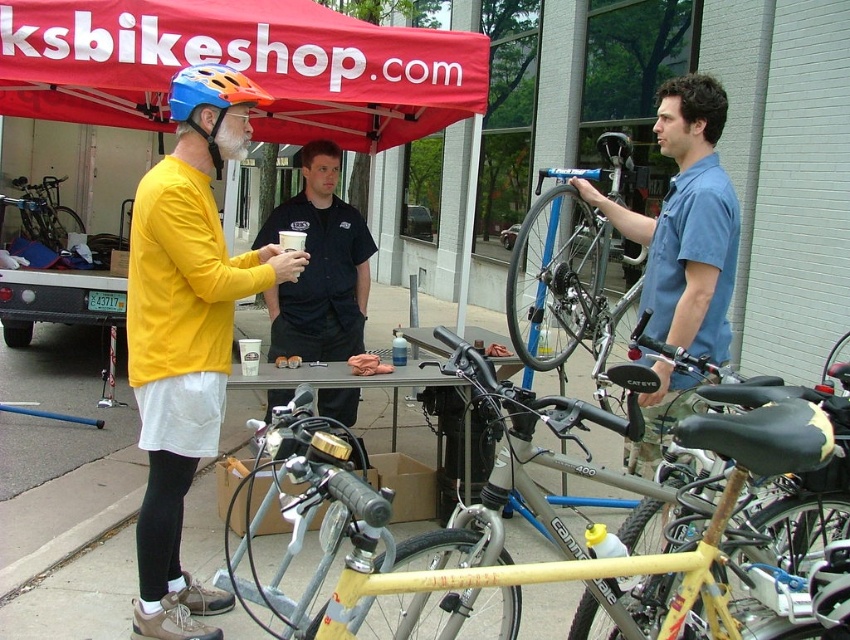
Question: Is blue metallic frame at center below black smooth shirt at center?

Choices:
 (A) no
 (B) yes

Answer: (A)

Question: Can you confirm if red fabric canopy at upper center is thinner than matte blue bicycle helmet at upper left?

Choices:
 (A) yes
 (B) no

Answer: (B)

Question: Which point appears farthest from the camera in this image?

Choices:
 (A) (23, 188)
 (B) (187, 67)
 (C) (552, 538)

Answer: (A)

Question: Does matte black bike at center have a lesser width compared to red fabric canopy at upper center?

Choices:
 (A) yes
 (B) no

Answer: (A)

Question: Which object is closer to the camera taking this photo?

Choices:
 (A) red fabric canopy at upper center
 (B) yellow long-sleeve shirt at center
 (C) blue metallic frame at center

Answer: (B)

Question: Which of the following is the farthest from the observer?

Choices:
 (A) yellow long-sleeve shirt at center
 (B) matte black bicycle at left
 (C) black smooth shirt at center

Answer: (B)